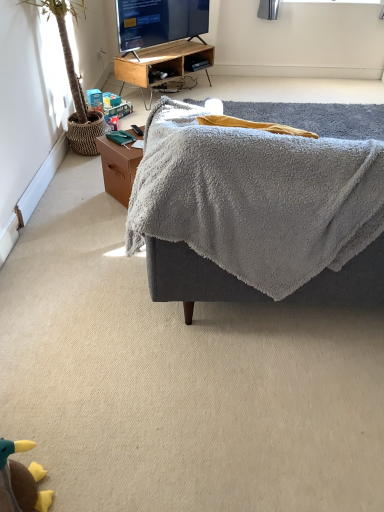
Identify the location of free location in front of green leafy plant at left. (76, 192).